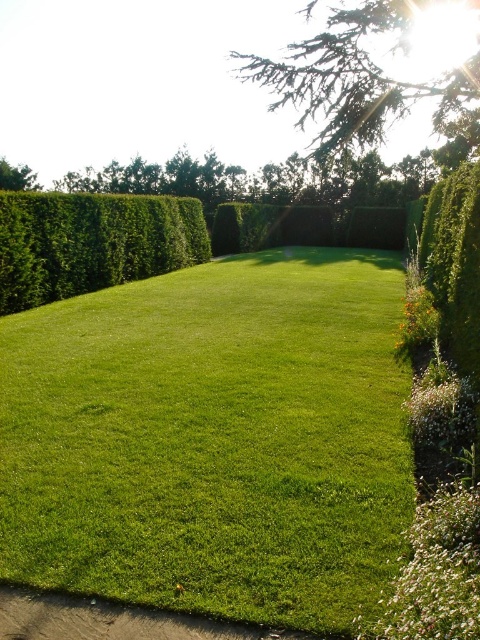
Question: Which of the following is the closest to the observer?

Choices:
 (A) green leafy bush at right
 (B) green leafy hedge at left
 (C) green textured hedge at upper center

Answer: (A)

Question: Observing the image, what is the correct spatial positioning of green grassy at center in reference to green leafy hedge at left?

Choices:
 (A) right
 (B) left

Answer: (A)

Question: Does green grassy at center appear on the right side of green leafy hedge at left?

Choices:
 (A) yes
 (B) no

Answer: (A)

Question: Which point is closer to the camera?

Choices:
 (A) green grassy at center
 (B) green leafy bush at right

Answer: (A)

Question: Which object appears closest to the camera in this image?

Choices:
 (A) green textured hedge at upper center
 (B) green grassy at center

Answer: (B)

Question: Is green grassy at center closer to camera compared to green textured hedge at upper center?

Choices:
 (A) yes
 (B) no

Answer: (A)